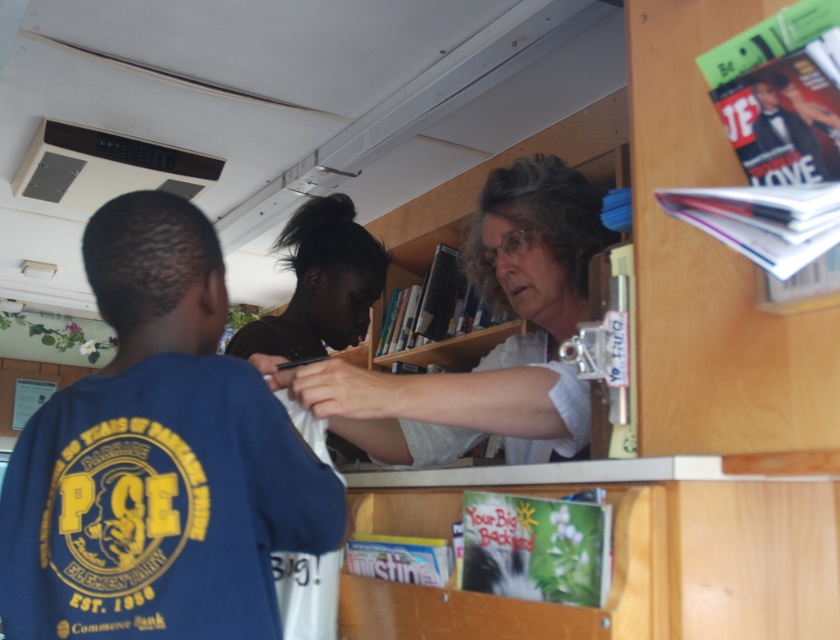
You are a student in the library and you want to reach the shiny plastic magazine at upper right without moving the blue cotton shirt at center. Is it possible?

The blue cotton shirt at center and shiny plastic magazine at upper right are 30.24 inches apart from each other. Since they are separated by this distance, you can reach the shiny plastic magazine at upper right without moving the blue cotton shirt at center.

You are standing in the library and see the white textured shirt at center and the shiny plastic magazine at upper right. From your perspective, which object is positioned to the left?

The white textured shirt at center is positioned to the left of the shiny plastic magazine at upper right.

In the scene shown: You are standing in the library and see two points marked on the floor. The first point is at coordinates point [397,385] and the second point is at point [424,288]. Which point is closer to you?

Point [397,385] is closer to the viewer than point [424,288].